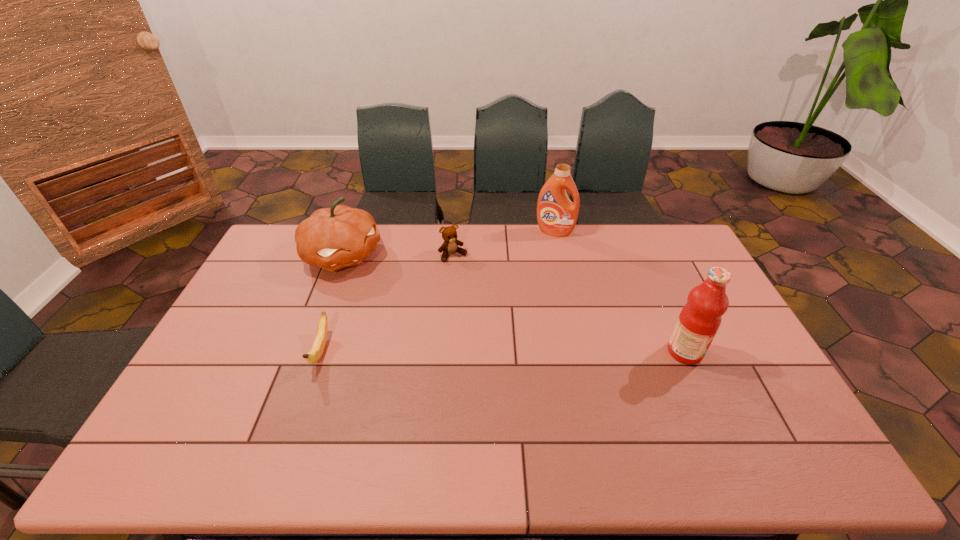
The width and height of the screenshot is (960, 540). In order to click on vacant space situated on the front-facing side of the third object from right to left in this screenshot , I will do click(x=504, y=324).

The height and width of the screenshot is (540, 960). Find the location of `vacant space located on the front-facing side of the second object from right to left`. vacant space located on the front-facing side of the second object from right to left is located at coordinates (532, 282).

In order to click on free space located 0.140m on the front-facing side of the second object from right to left in this screenshot , I will do `click(541, 259)`.

Where is `vacant area located on the front-facing side of the second object from right to left`? vacant area located on the front-facing side of the second object from right to left is located at coordinates (544, 252).

Identify the location of free space located 0.130m on the front face of the pumpkin. This screenshot has width=960, height=540. (388, 293).

At what (x,y) coordinates should I click in order to perform the action: click on free space located on the front face of the pumpkin. Please return your answer as a coordinate pair (x, y). Looking at the image, I should click on (414, 314).

Find the location of a particular element. This screenshot has width=960, height=540. vacant space located 0.300m on the front face of the pumpkin is located at coordinates (x=420, y=319).

Locate an element on the screen. This screenshot has width=960, height=540. teddy bear that is at the far edge is located at coordinates (449, 234).

Locate an element on the screen. The image size is (960, 540). detergent at the far edge is located at coordinates (556, 215).

At what (x,y) coordinates should I click in order to perform the action: click on pumpkin at the far edge. Please return your answer as a coordinate pair (x, y). Looking at the image, I should click on (332, 238).